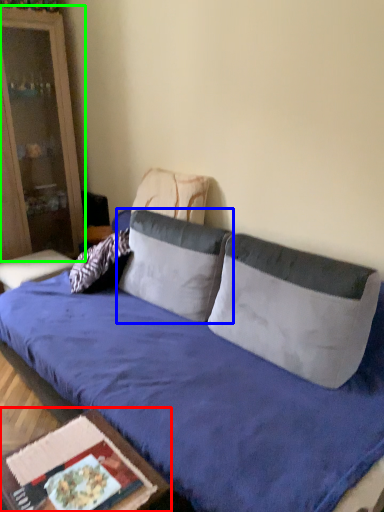
Question: Which object is positioned farthest from table (highlighted by a red box)? Select from pillow (highlighted by a blue box) and cabinetry (highlighted by a green box).

Choices:
 (A) pillow
 (B) cabinetry

Answer: (B)